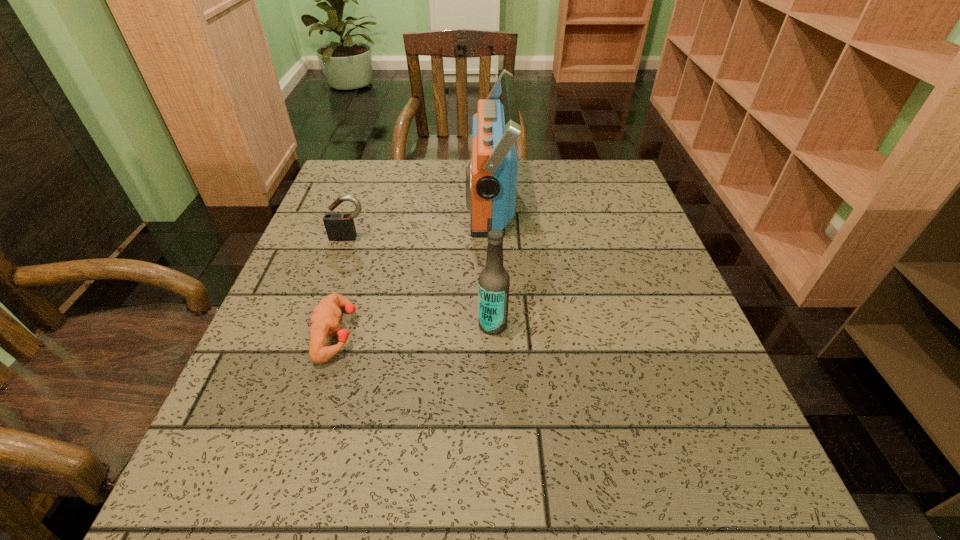
In the image, there is a desktop. Identify the location of vacant space at the near left corner. (224, 464).

At what (x,y) coordinates should I click in order to perform the action: click on free region at the far right corner of the desktop. Please return your answer as a coordinate pair (x, y). The width and height of the screenshot is (960, 540). Looking at the image, I should click on (589, 188).

What are the coordinates of `blank space at the near right corner of the desktop` in the screenshot? It's located at (769, 505).

The height and width of the screenshot is (540, 960). In order to click on vacant space that is in between the puncher and the radio receiver in this screenshot , I will do `click(414, 267)`.

Image resolution: width=960 pixels, height=540 pixels. I want to click on free area in between the puncher and the radio receiver, so click(x=414, y=267).

The image size is (960, 540). What are the coordinates of `free spot between the padlock and the tallest object` in the screenshot? It's located at click(420, 220).

This screenshot has width=960, height=540. Identify the location of vacant area that lies between the radio receiver and the second shortest object. (420, 220).

At what (x,y) coordinates should I click in order to perform the action: click on empty space that is in between the beer bottle and the shortest object. Please return your answer as a coordinate pair (x, y). The height and width of the screenshot is (540, 960). Looking at the image, I should click on (415, 329).

Identify the location of vacant area that lies between the padlock and the tallest object. The height and width of the screenshot is (540, 960). point(420,220).

This screenshot has height=540, width=960. In order to click on free space between the puncher and the beer bottle in this screenshot , I will do `click(415, 329)`.